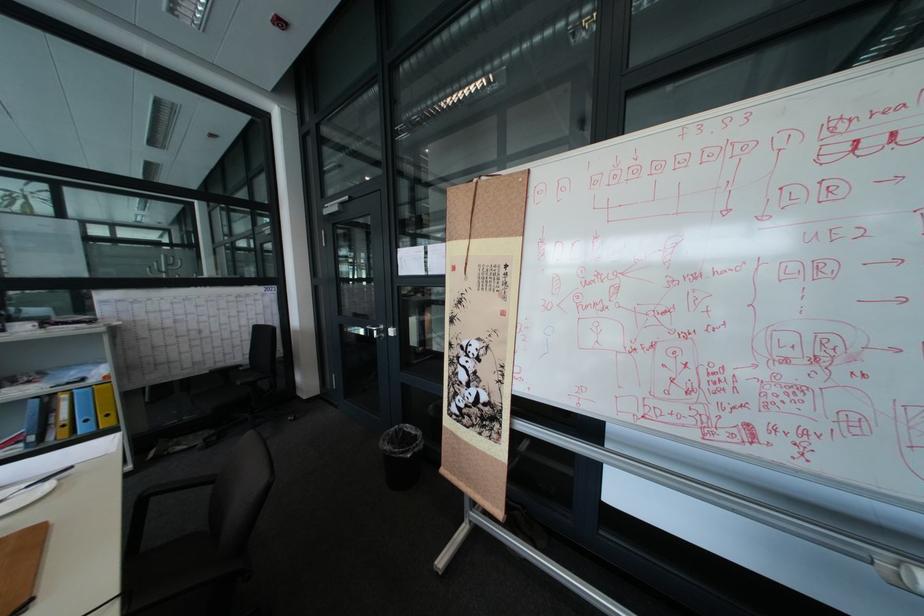
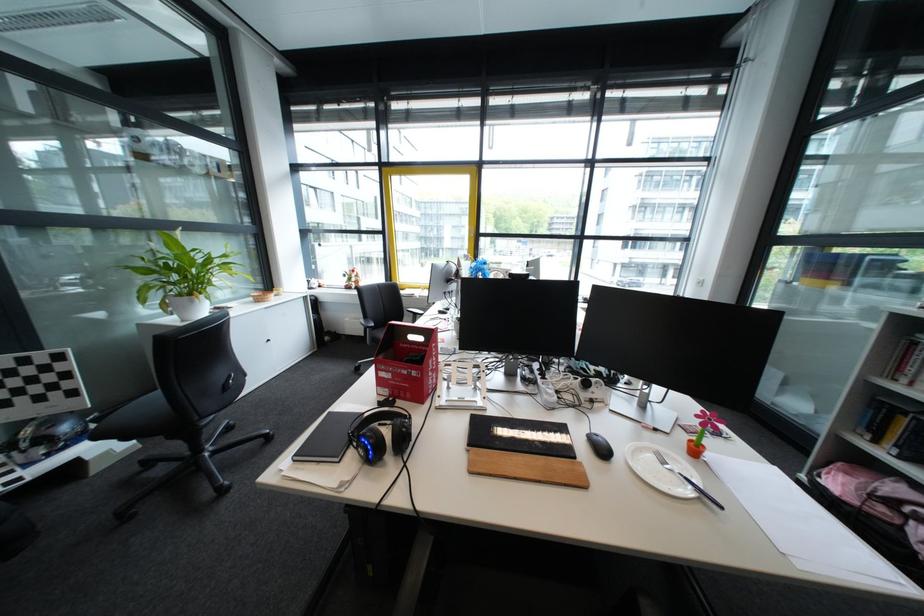
Locate, in the second image, the point that corresponds to point 73,480 in the first image.

(712, 501)